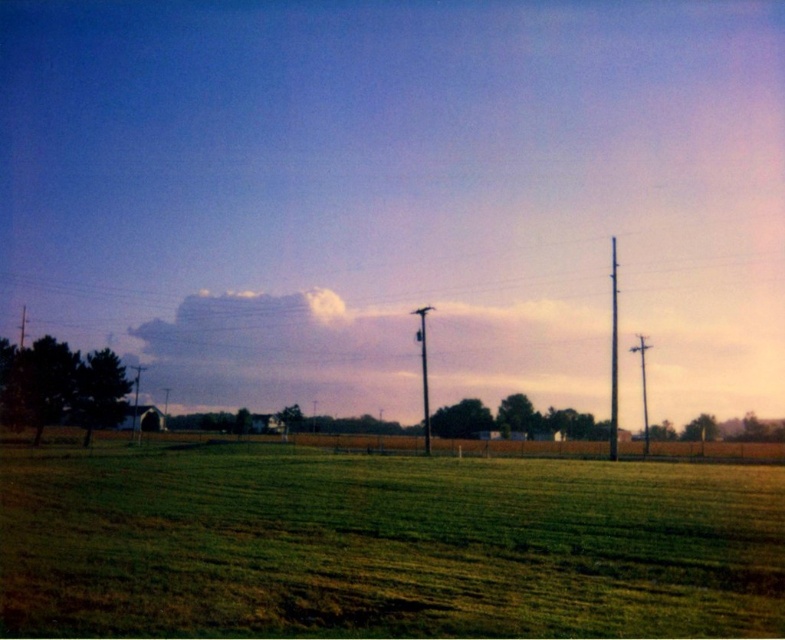
Which is below, green grassy field at center or smooth metallic pole at center?

Positioned lower is smooth metallic pole at center.

Can you confirm if green grassy field at center is thinner than smooth metallic pole at center?

Incorrect, green grassy field at center's width is not less than smooth metallic pole at center's.

Which is in front, point (528, 547) or point (422, 388)?

Point (528, 547)

This screenshot has width=785, height=640. What are the coordinates of `green grassy field at center` in the screenshot? It's located at (382, 545).

Is point (725, 592) behind point (612, 260)?

No, it is in front of (612, 260).

Who is taller, green grassy field at center or metallic gray pole at right?

Standing taller between the two is metallic gray pole at right.

Which is behind, point (509, 522) or point (614, 442)?

The point (614, 442) is more distant.

Where is `green grassy field at center`? The height and width of the screenshot is (640, 785). green grassy field at center is located at coordinates (382, 545).

Who is higher up, metallic gray pole at right or smooth metallic pole at center?

Positioned higher is metallic gray pole at right.

Locate an element on the screen. This screenshot has width=785, height=640. metallic gray pole at right is located at coordinates (612, 353).

The width and height of the screenshot is (785, 640). Find the location of `metallic gray pole at right`. metallic gray pole at right is located at coordinates (612, 353).